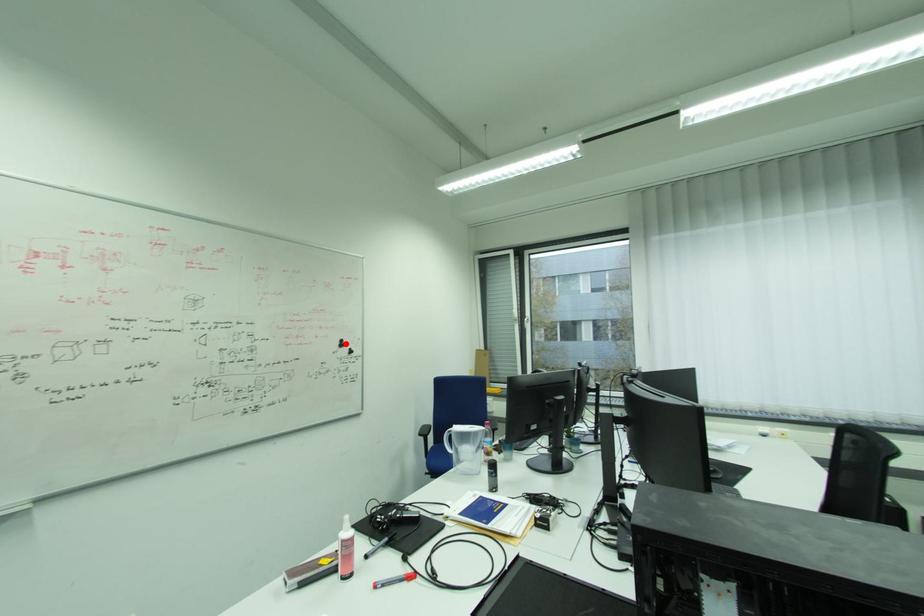
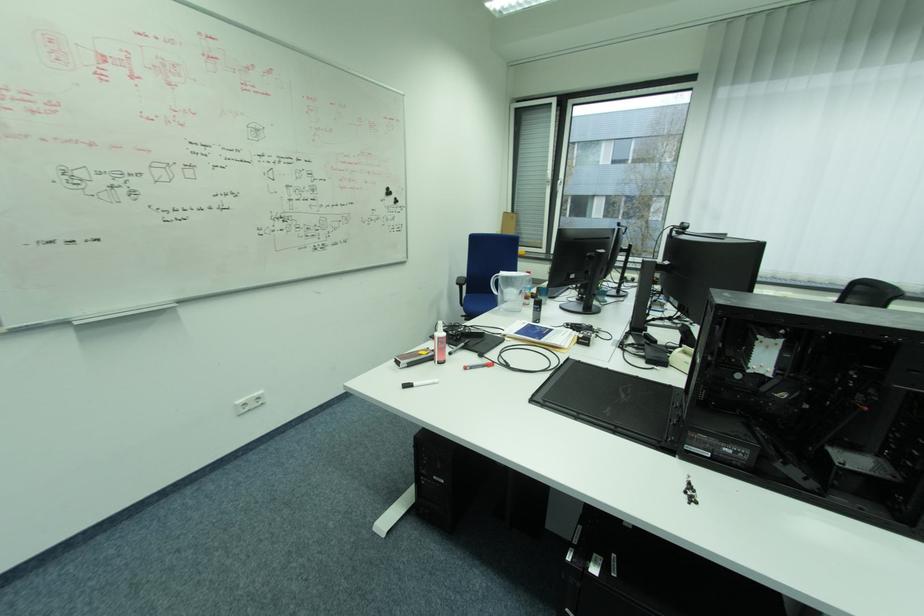
Question: A red point is marked in image1. In image2, is the corresponding 3D point closer to the camera or farther? Reply with the corresponding letter.

Choices:
 (A) The corresponding 3D point is closer.
 (B) The corresponding 3D point is farther.

Answer: (A)